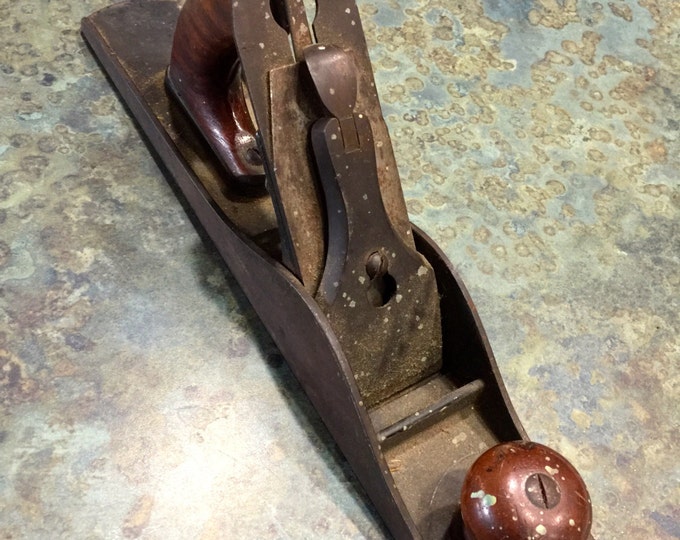
Locate an element on the screen. knob is located at coordinates (503, 498), (575, 496).